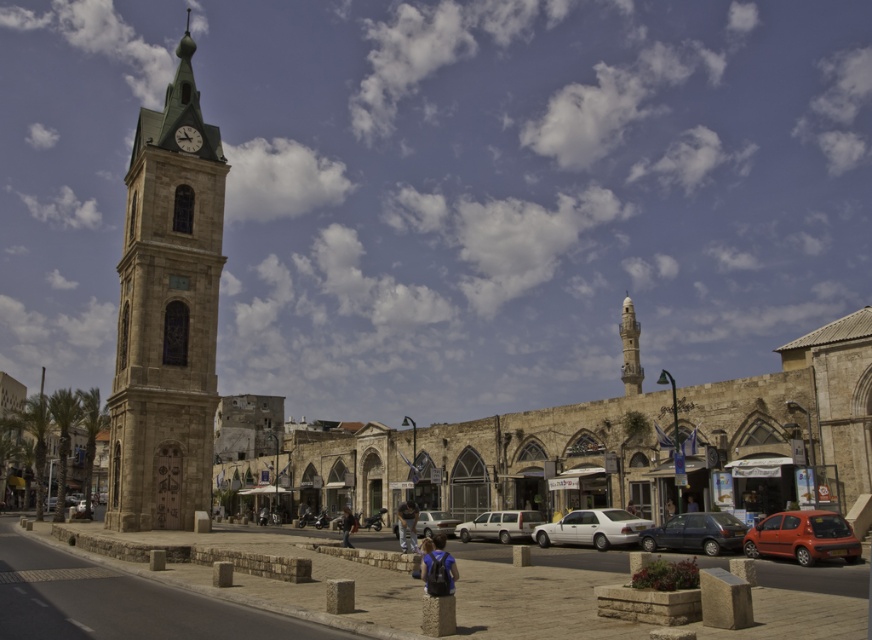
Who is positioned more to the right, white matte sedan at center or silver metallic van at center?

From the viewer's perspective, white matte sedan at center appears more on the right side.

Who is taller, white matte sedan at center or silver metallic van at center?

silver metallic van at center

Who is more forward, (588,522) or (506,540)?

Point (588,522)

Identify the location of white matte sedan at center. (591, 529).

Describe the element at coordinates (802, 536) in the screenshot. I see `shiny red car at lower right` at that location.

Which is more to the right, shiny red car at lower right or matte brown clock at upper left?

shiny red car at lower right

I want to click on shiny red car at lower right, so click(x=802, y=536).

Between point (181, 141) and point (629, 500), which one is positioned behind?

Positioned behind is point (181, 141).

Consider the image. Can you confirm if matte brown clock at upper left is positioned to the left of dark blue fabric jacket at center?

Yes, matte brown clock at upper left is to the left of dark blue fabric jacket at center.

What do you see at coordinates (187, 138) in the screenshot?
I see `matte brown clock at upper left` at bounding box center [187, 138].

Image resolution: width=872 pixels, height=640 pixels. Find the location of `matte brown clock at upper left`. matte brown clock at upper left is located at coordinates (187, 138).